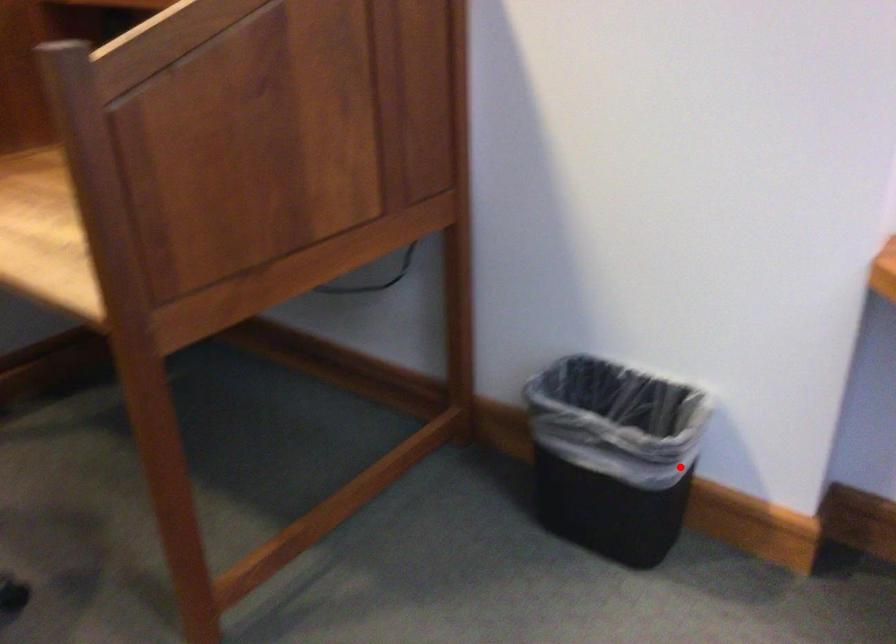
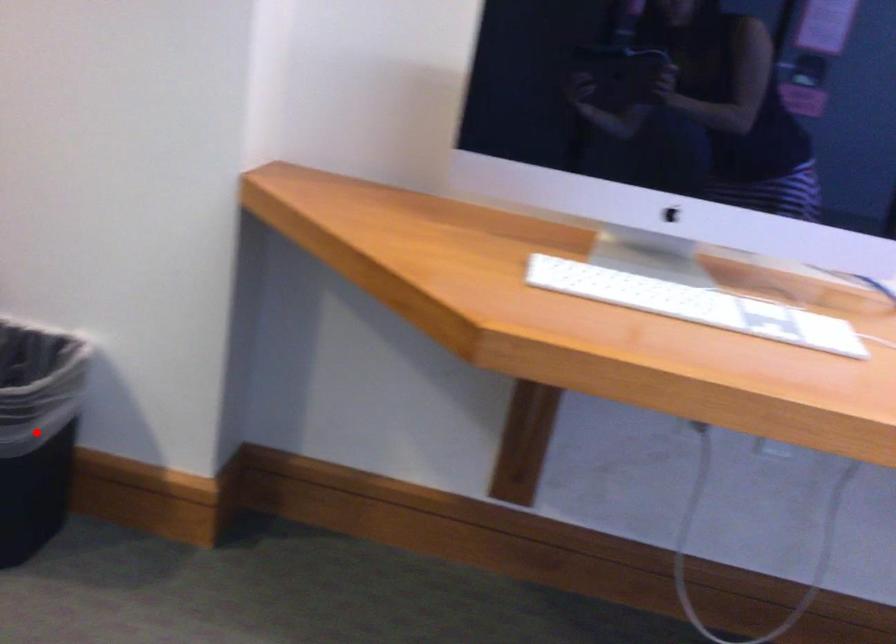
I am providing you with two images of the same scene from different viewpoints. A red point is marked on the first image and another point is marked on the second image. Do the highlighted points in image1 and image2 indicate the same real-world spot?

No